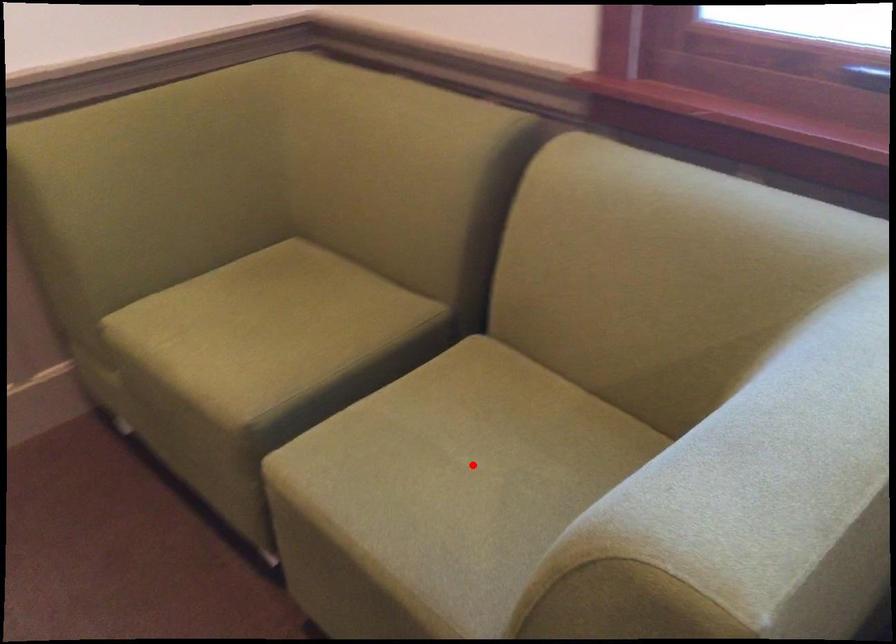
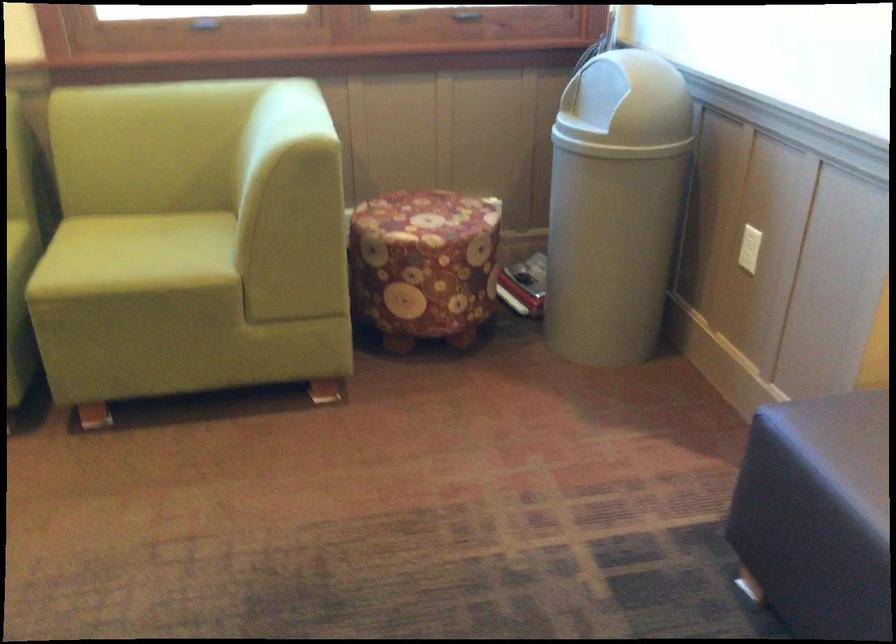
Question: I am providing you with two images of the same scene from different viewpoints. In image1, a red point is highlighted. Considering the same 3D point in image2, which of the following is correct?

Choices:
 (A) It is closer
 (B) It is farther

Answer: (B)